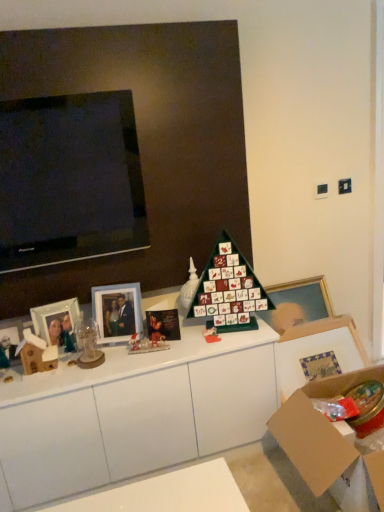
Question: Is cardboard box at lower right not inside glossy paper christmas card at center?

Choices:
 (A) yes
 (B) no

Answer: (A)

Question: Does cardboard box at lower right have a lesser width compared to glossy paper christmas card at center?

Choices:
 (A) yes
 (B) no

Answer: (B)

Question: Is cardboard box at lower right aimed at glossy paper christmas card at center?

Choices:
 (A) yes
 (B) no

Answer: (B)

Question: Considering the relative sizes of cardboard box at lower right and glossy paper christmas card at center in the image provided, is cardboard box at lower right smaller than glossy paper christmas card at center?

Choices:
 (A) no
 (B) yes

Answer: (A)

Question: Does cardboard box at lower right have a greater height compared to glossy paper christmas card at center?

Choices:
 (A) yes
 (B) no

Answer: (A)

Question: Are cardboard box at lower right and glossy paper christmas card at center far apart?

Choices:
 (A) no
 (B) yes

Answer: (A)

Question: Does white glossy cabinet at center come behind wooden house at left?

Choices:
 (A) no
 (B) yes

Answer: (A)

Question: Could wooden house at left be considered to be inside white glossy cabinet at center?

Choices:
 (A) no
 (B) yes

Answer: (A)

Question: Considering the relative sizes of white glossy cabinet at center and wooden house at left in the image provided, is white glossy cabinet at center wider than wooden house at left?

Choices:
 (A) yes
 (B) no

Answer: (A)

Question: From a real-world perspective, is white glossy cabinet at center located higher than wooden house at left?

Choices:
 (A) yes
 (B) no

Answer: (B)

Question: Could you tell me if white glossy cabinet at center is facing wooden house at left?

Choices:
 (A) no
 (B) yes

Answer: (A)

Question: From a real-world perspective, does white glossy cabinet at center sit lower than wooden house at left?

Choices:
 (A) no
 (B) yes

Answer: (B)

Question: Does matte glass photo frame at left, the third picture frame when ordered from right to left, have a smaller size compared to glossy paper christmas card at center?

Choices:
 (A) yes
 (B) no

Answer: (A)